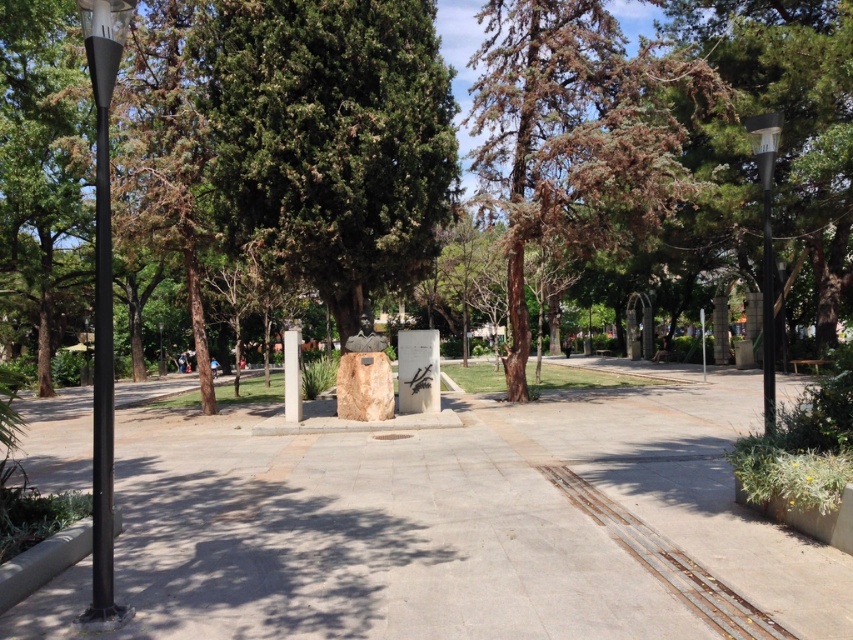
Does green textured tree at center lie behind brown textured tree at center?

No, green textured tree at center is closer to the viewer.

Is point (282, 234) farther from camera compared to point (555, 193)?

That is False.

Locate an element on the screen. The width and height of the screenshot is (853, 640). green textured tree at center is located at coordinates click(x=334, y=138).

Between gray concrete pavement at center and metallic gray pole at right, which one appears on the right side from the viewer's perspective?

metallic gray pole at right

You are a GUI agent. You are given a task and a screenshot of the screen. Output one action in this format:
    pyautogui.click(x=<x>, y=<y>)
    Task: Click on the gray concrete pavement at center
    Image resolution: width=853 pixels, height=640 pixels.
    Given the screenshot: What is the action you would take?
    pyautogui.click(x=456, y=524)

Locate an element on the screen. Image resolution: width=853 pixels, height=640 pixels. gray concrete pavement at center is located at coordinates (456, 524).

Who is more forward, [660,538] or [769,172]?

Point [660,538] is in front.

Which is more to the left, rusty metal train track at lower right or metallic gray pole at right?

From the viewer's perspective, rusty metal train track at lower right appears more on the left side.

Who is more distant from viewer, (x=535, y=467) or (x=773, y=148)?

The point (x=535, y=467) is more distant.

Identify the location of rusty metal train track at lower right. (668, 563).